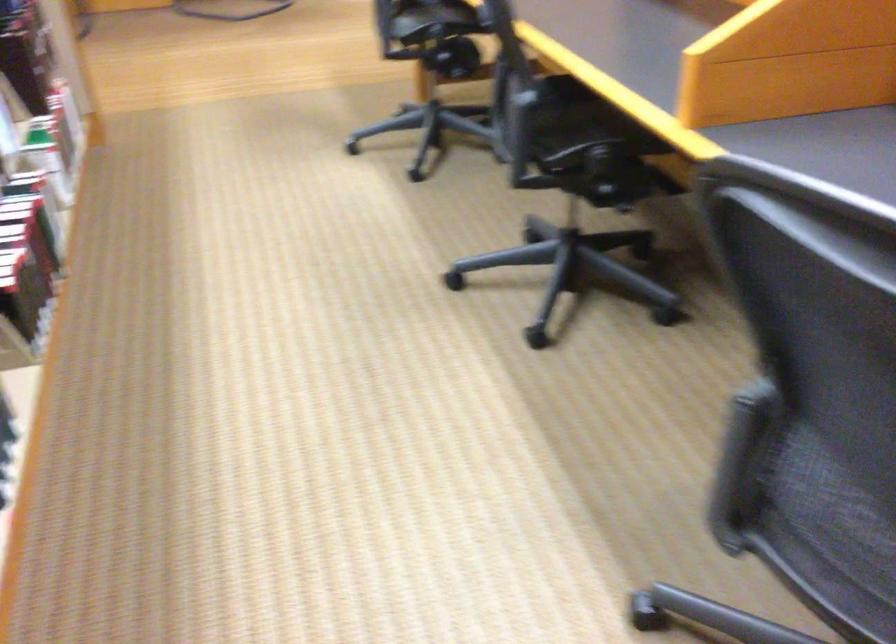
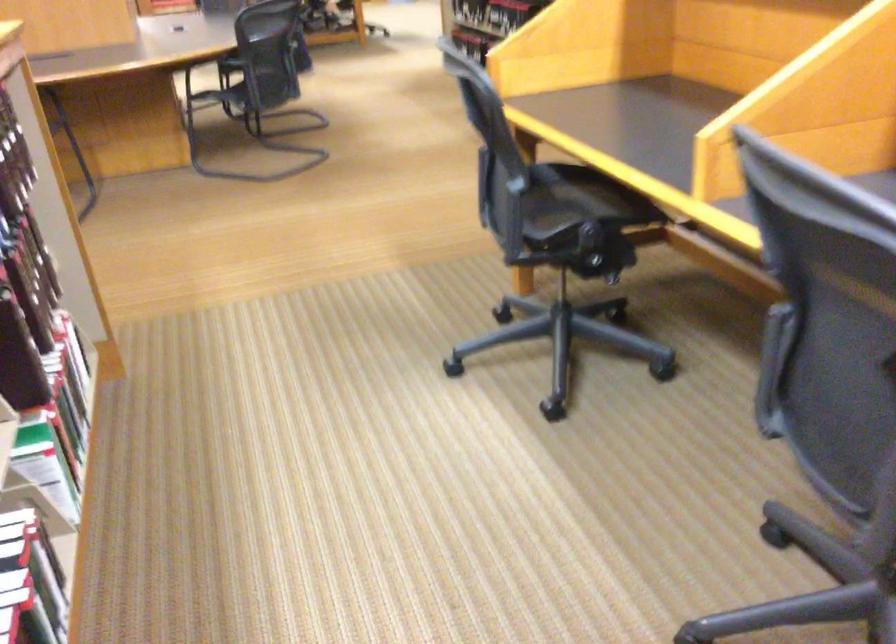
Find the pixel in the second image that matches pixel 518 71 in the first image.

(830, 341)